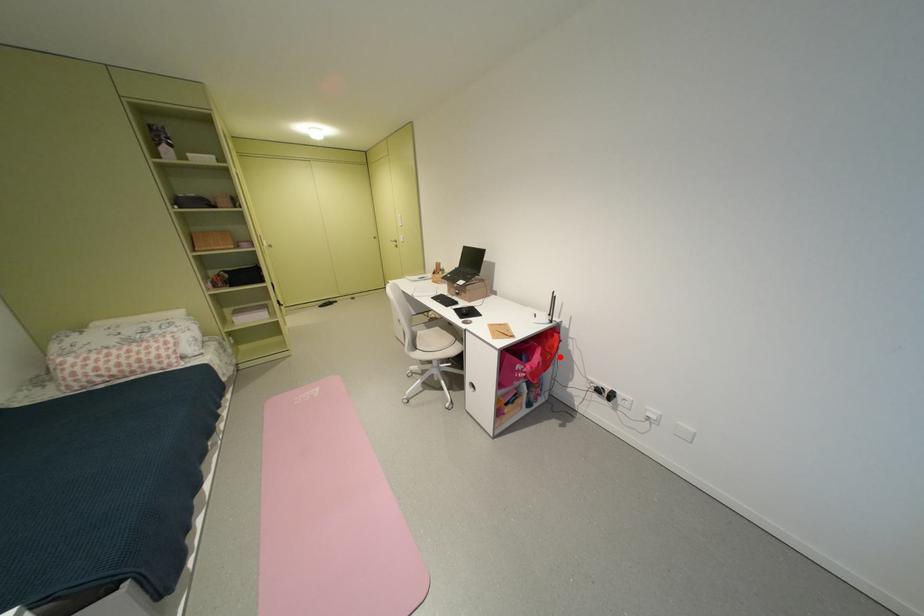
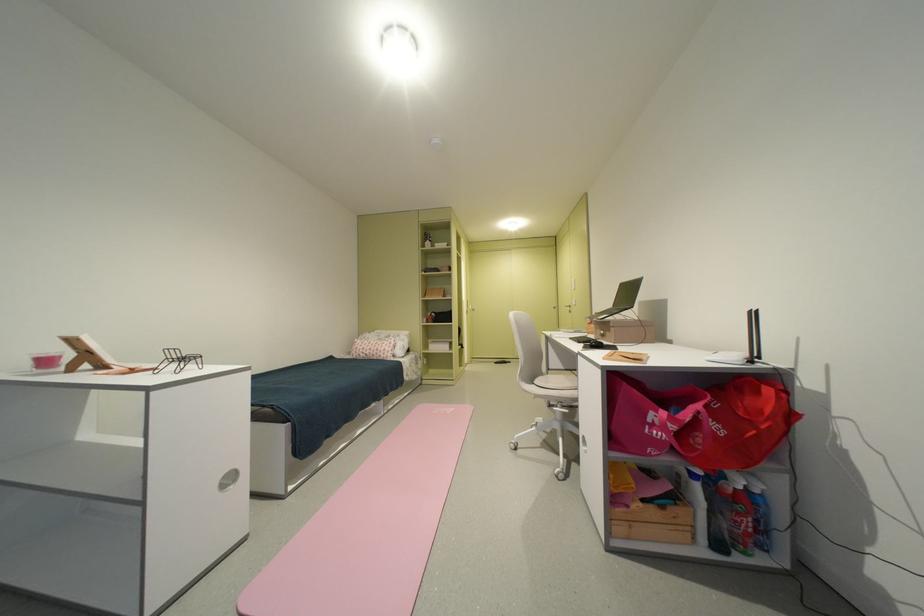
Question: I am providing you with two images of the same scene from different viewpoints. Given a red point in image1, look at the same physical point in image2. Is it:

Choices:
 (A) Closer to the viewpoint
 (B) Farther from the viewpoint

Answer: (A)